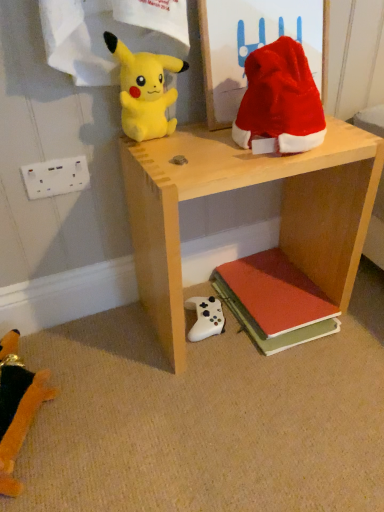
Question: Is velvet red santa hat at upper right, the first toy in the right-to-left sequence, wider or thinner than velvet orange stuffed toy at lower left, which ranks as the fourth toy in right-to-left order?

Choices:
 (A) thin
 (B) wide

Answer: (A)

Question: Is velvet red santa hat at upper right, the first toy in the right-to-left sequence, in front of or behind velvet orange stuffed toy at lower left, which is the 4th toy in top-to-bottom order, in the image?

Choices:
 (A) front
 (B) behind

Answer: (A)

Question: Estimate the real-world distances between objects in this image. Which object is farther from the yellow plush toy at upper left, the third toy when ordered from right to left?

Choices:
 (A) velvet red santa hat at upper right, which ranks as the second toy in top-to-bottom order
 (B) velvet orange stuffed toy at lower left, arranged as the first toy when viewed from the left
 (C) red matte book at lower right
 (D) white matte game controller at lower center, the 3th toy positioned from the left
 (E) white plastic/socket at lower left

Answer: (B)

Question: Estimate the real-world distances between objects in this image. Which object is closer to the yellow plush toy at upper left, the 4th toy when ordered from bottom to top?

Choices:
 (A) velvet orange stuffed toy at lower left, which ranks as the fourth toy in right-to-left order
 (B) white plastic/socket at lower left
 (C) red matte book at lower right
 (D) velvet red santa hat at upper right, which ranks as the second toy in top-to-bottom order
 (E) white matte game controller at lower center, positioned as the second toy in bottom-to-top order

Answer: (D)